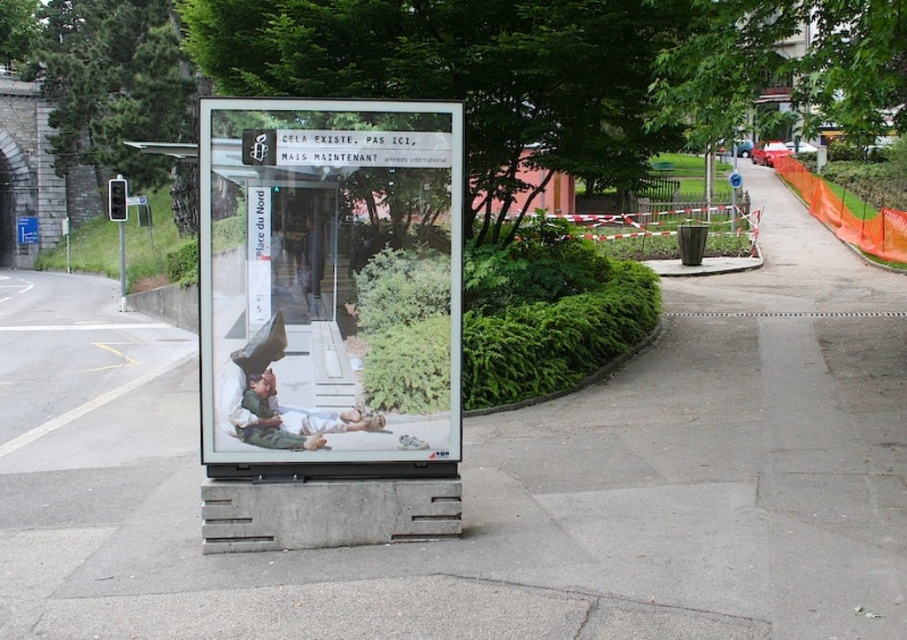
Question: Is clear glass billboard at center closer to the viewer compared to white cotton shirt at center?

Choices:
 (A) yes
 (B) no

Answer: (A)

Question: Which point is closer to the camera?

Choices:
 (A) (309, 264)
 (B) (274, 428)

Answer: (B)

Question: In this image, where is clear glass billboard at center located relative to white cotton shirt at center?

Choices:
 (A) above
 (B) below

Answer: (A)

Question: Does clear glass billboard at center appear on the right side of white cotton shirt at center?

Choices:
 (A) no
 (B) yes

Answer: (B)

Question: Which object is closer to the camera taking this photo?

Choices:
 (A) white cotton shirt at center
 (B) clear glass billboard at center

Answer: (B)